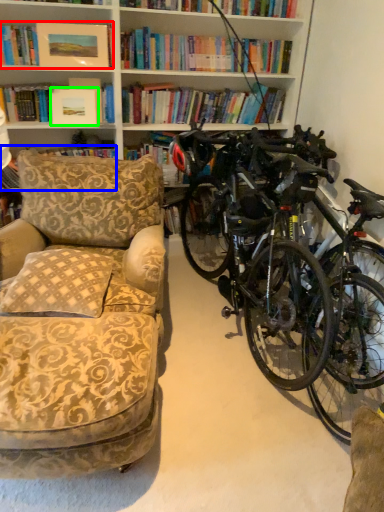
Question: Which object is the closest to the book (highlighted by a red box)? Choose among these: book (highlighted by a blue box) or picture frame (highlighted by a green box).

Choices:
 (A) book
 (B) picture frame

Answer: (B)